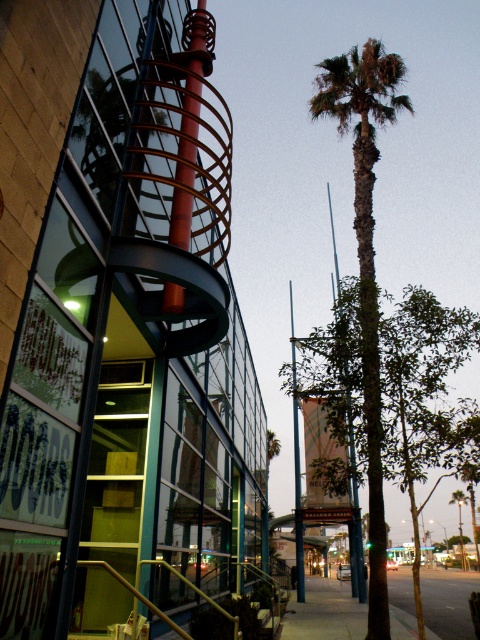
You are a city planner assessing the space between two green leafy trees in the urban scene. The trees are the green leafy tree at center and the green leafy palm tree at center. Which tree has a narrower width?

The green leafy tree at center has a lesser width compared to the green leafy palm tree at center, so the green leafy tree at center is narrower.

You are a city planner assessing the urban space. You need to determine which tree, the green leafy tree at center or the green leafy palm tree at center, requires more space for growth. Based on their sizes, which one would need more room?

The green leafy palm tree at center is larger than the green leafy tree at center, so it would require more space for growth.